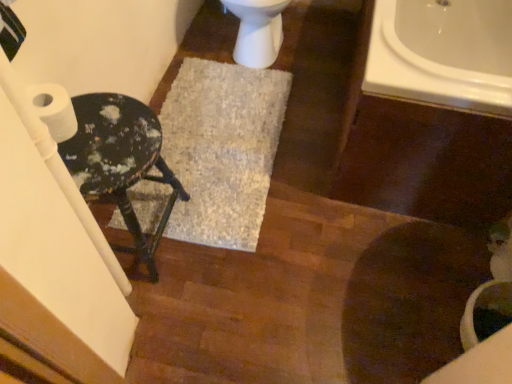
Describe the element at coordinates (119, 161) in the screenshot. This screenshot has width=512, height=384. I see `black painted stool at left` at that location.

Where is `black painted stool at left`? black painted stool at left is located at coordinates click(119, 161).

Where is `black painted stool at left`? black painted stool at left is located at coordinates (119, 161).